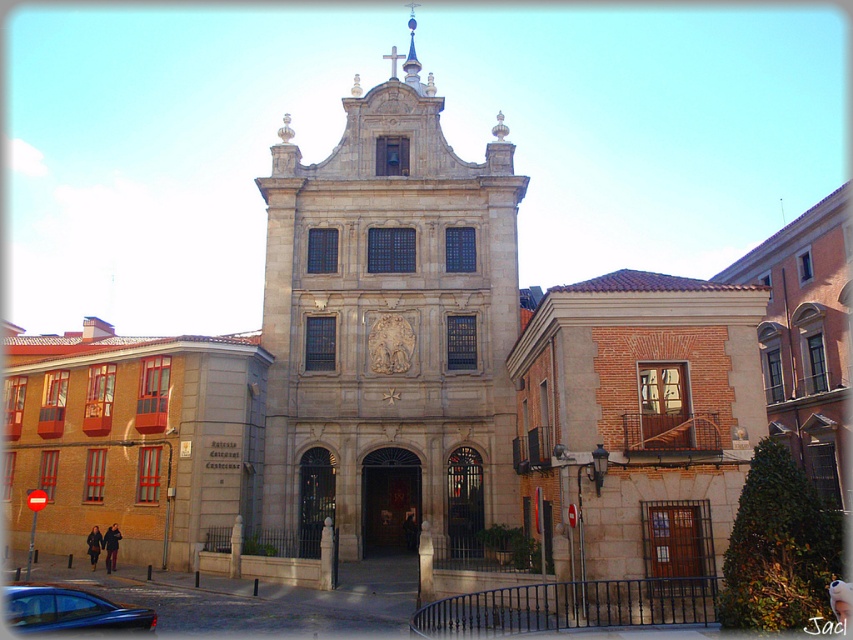
Which of these two, stone church at center or shiny black car at lower left, stands taller?

Standing taller between the two is stone church at center.

Can you confirm if stone church at center is smaller than shiny black car at lower left?

No.

Image resolution: width=853 pixels, height=640 pixels. What do you see at coordinates (390, 326) in the screenshot?
I see `stone church at center` at bounding box center [390, 326].

Locate an element on the screen. stone church at center is located at coordinates (390, 326).